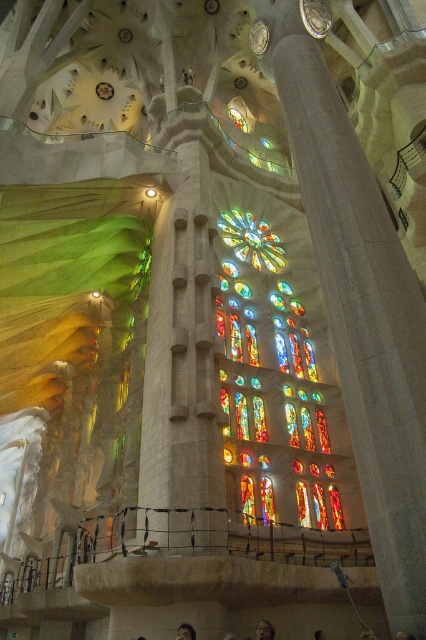
Question: Does white stone column at center appear on the left side of stained glass window at center?

Choices:
 (A) no
 (B) yes

Answer: (B)

Question: Does smooth stone pillar at center come in front of smooth skin face at lower center?

Choices:
 (A) no
 (B) yes

Answer: (B)

Question: Estimate the real-world distances between objects in this image. Which object is closer to the smooth stone pillar at center?

Choices:
 (A) white stone column at center
 (B) stained glass window at center
 (C) dark brown hair at lower center
 (D) smooth skin face at lower center

Answer: (A)

Question: Can you confirm if smooth stone pillar at center is thinner than white stone column at center?

Choices:
 (A) no
 (B) yes

Answer: (A)

Question: Which object appears farthest from the camera in this image?

Choices:
 (A) dark brown hair at lower center
 (B) smooth stone pillar at center
 (C) white stone column at center
 (D) smooth skin face at lower center

Answer: (C)

Question: Which point is farther to the camera?

Choices:
 (A) smooth skin face at lower center
 (B) stained glass window at center
 (C) smooth stone pillar at center
 (D) white stone column at center

Answer: (B)